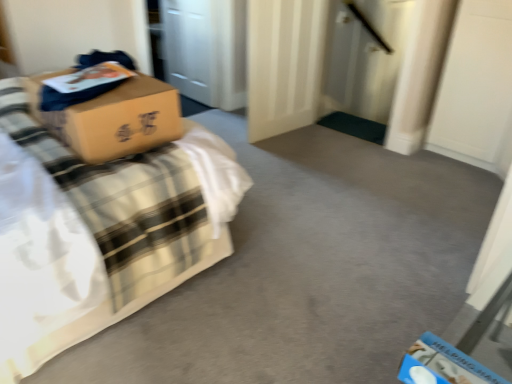
Question: From a real-world perspective, is white matte door at center located higher than matte cardboard box at upper left?

Choices:
 (A) yes
 (B) no

Answer: (B)

Question: Is matte cardboard box at upper left located within white matte door at center?

Choices:
 (A) yes
 (B) no

Answer: (B)

Question: Considering the relative positions of white matte door at center and matte cardboard box at upper left in the image provided, is white matte door at center to the left of matte cardboard box at upper left from the viewer's perspective?

Choices:
 (A) yes
 (B) no

Answer: (B)

Question: Is white matte door at center further to camera compared to matte cardboard box at upper left?

Choices:
 (A) no
 (B) yes

Answer: (B)

Question: Is white matte door at center facing towards matte cardboard box at upper left?

Choices:
 (A) yes
 (B) no

Answer: (B)

Question: From a real-world perspective, is white matte door at center below matte cardboard box at upper left?

Choices:
 (A) yes
 (B) no

Answer: (A)

Question: Is matte cardboard box at upper left shorter than white matte door at center?

Choices:
 (A) no
 (B) yes

Answer: (A)

Question: Does matte cardboard box at upper left have a larger size compared to white matte door at center?

Choices:
 (A) no
 (B) yes

Answer: (B)

Question: From a real-world perspective, is matte cardboard box at upper left on top of white matte door at center?

Choices:
 (A) no
 (B) yes

Answer: (B)

Question: Can you confirm if matte cardboard box at upper left is smaller than white matte door at center?

Choices:
 (A) no
 (B) yes

Answer: (A)

Question: Is white matte door at center surrounded by matte cardboard box at upper left?

Choices:
 (A) yes
 (B) no

Answer: (B)

Question: Is matte cardboard box at upper left thinner than white matte door at center?

Choices:
 (A) yes
 (B) no

Answer: (B)

Question: In the image, is matte cardboard box at upper left on the left side or the right side of white matte door at center?

Choices:
 (A) left
 (B) right

Answer: (A)